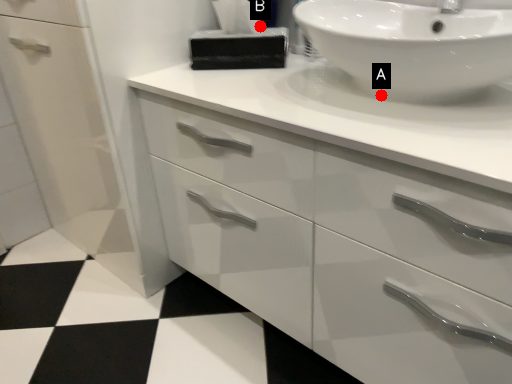
Question: Two points are circled on the image, labeled by A and B beside each circle. Which point appears closest to the camera in this image?

Choices:
 (A) A is closer
 (B) B is closer

Answer: (A)